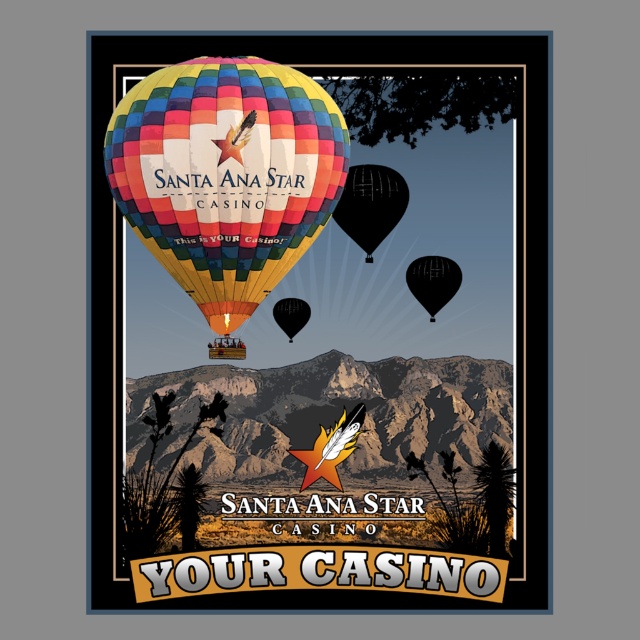
Question: Is rugged stone mountain at center below black matte balloon at upper right?

Choices:
 (A) no
 (B) yes

Answer: (B)

Question: Is multicolored fabric hot air balloon at upper center wider than multicolored fabric hot air balloon at center?

Choices:
 (A) yes
 (B) no

Answer: (A)

Question: Which point is closer to the camera?

Choices:
 (A) (179, 189)
 (B) (291, 438)
 (C) (458, 276)

Answer: (A)

Question: Considering the real-world distances, which object is farthest from the multicolored fabric hot air balloon at upper center?

Choices:
 (A) black matte balloon at upper right
 (B) black matte balloon at center
 (C) rugged stone mountain at center
 (D) black glossy balloon at center

Answer: (A)

Question: Does multicolored fabric hot air balloon at center have a greater width compared to black matte balloon at upper right?

Choices:
 (A) yes
 (B) no

Answer: (A)

Question: Which object is the closest to the black matte balloon at upper right?

Choices:
 (A) rugged stone mountain at center
 (B) black glossy balloon at center

Answer: (B)